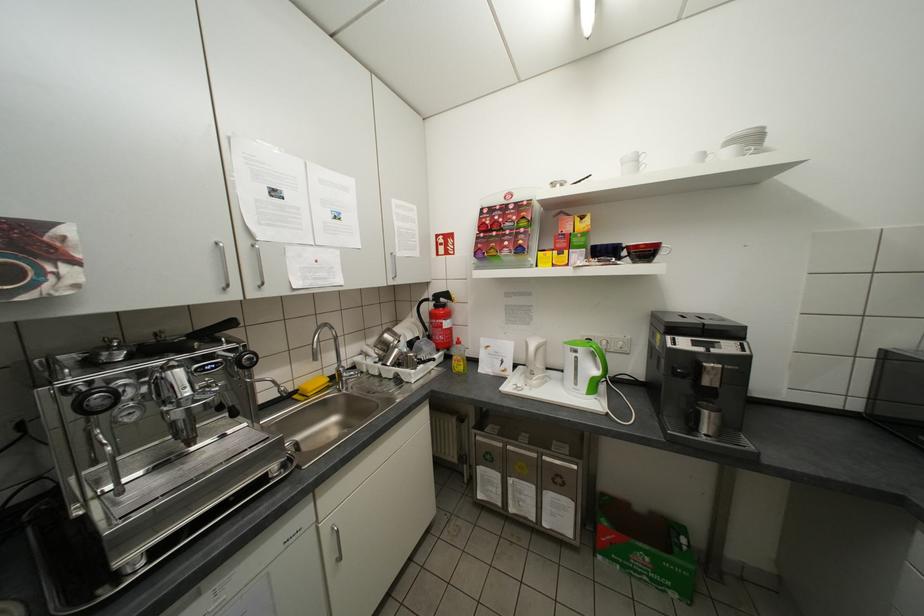
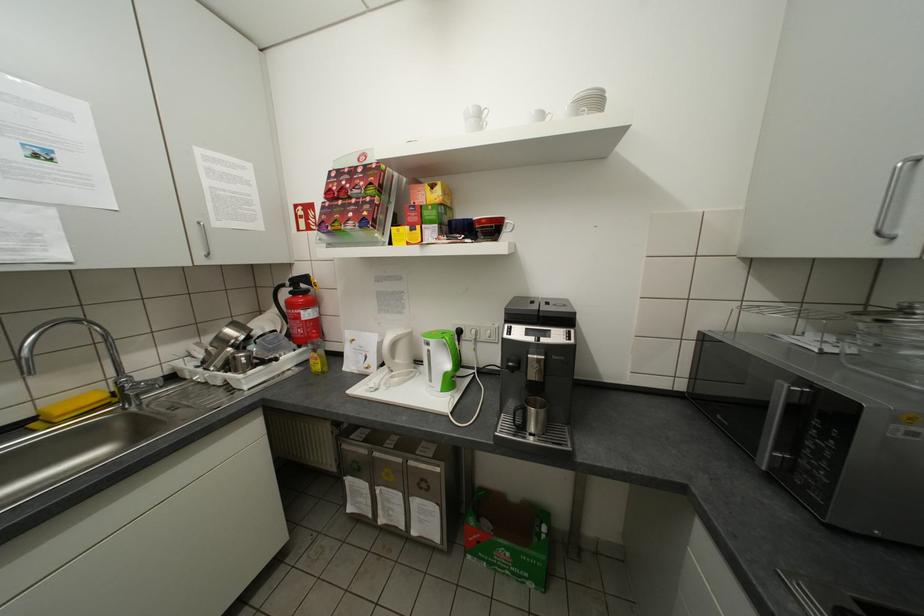
Locate, in the second image, the point that corresponds to [543,382] in the first image.

(406, 379)